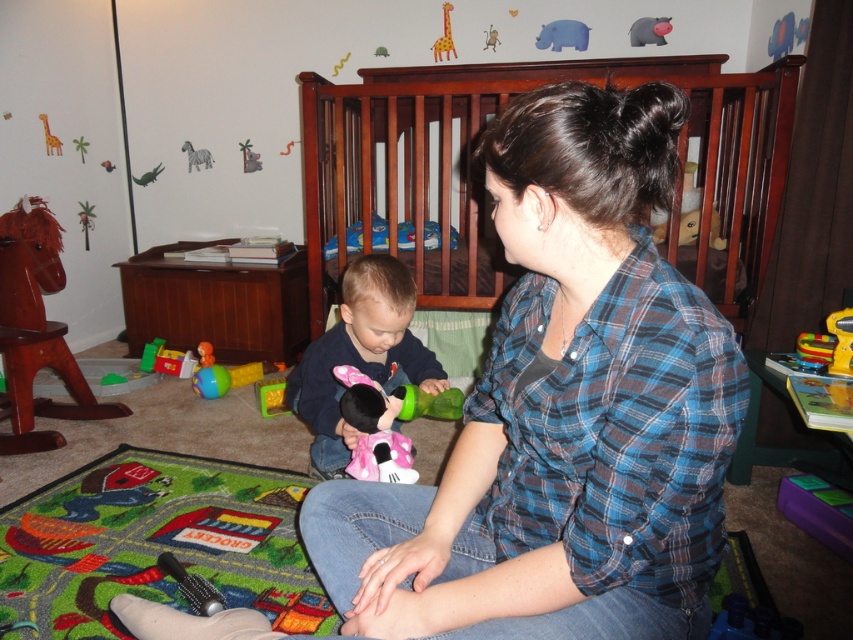
You are a parent in the nursery and want to place the matte pink plush toy at center into the wooden crib at center. Based on their positions, which direction should you move the toy to reach the crib?

The wooden crib at center is to the right of the matte pink plush toy at center, so you should move the toy to the right to place it into the wooden crib at center.

Based on the photo, based on the scene description, where is the wooden crib at center located in terms of its 2D coordinates?

The wooden crib at center is located at the 2D coordinates point (480, 177).

Based on the photo, you are a parent in the nursery and want to place the yellow matte giraffe at upper center on the wooden crib at center. Can the giraffe fit on the crib without overhanging the edges?

The wooden crib at center is wider than the yellow matte giraffe at upper center, so the giraffe can fit on the wooden crib at center without overhanging the edges.